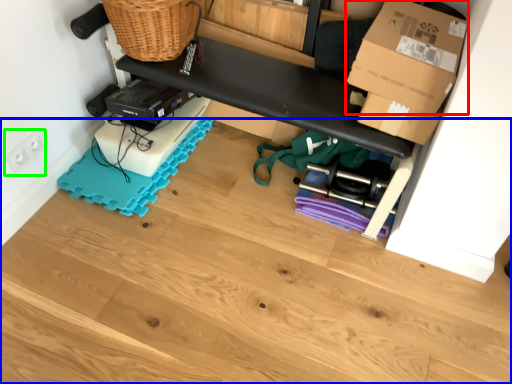
Question: Which object is positioned closest to box (highlighted by a red box)? Select from wood (highlighted by a blue box) and electric outlet (highlighted by a green box).

Choices:
 (A) wood
 (B) electric outlet

Answer: (A)